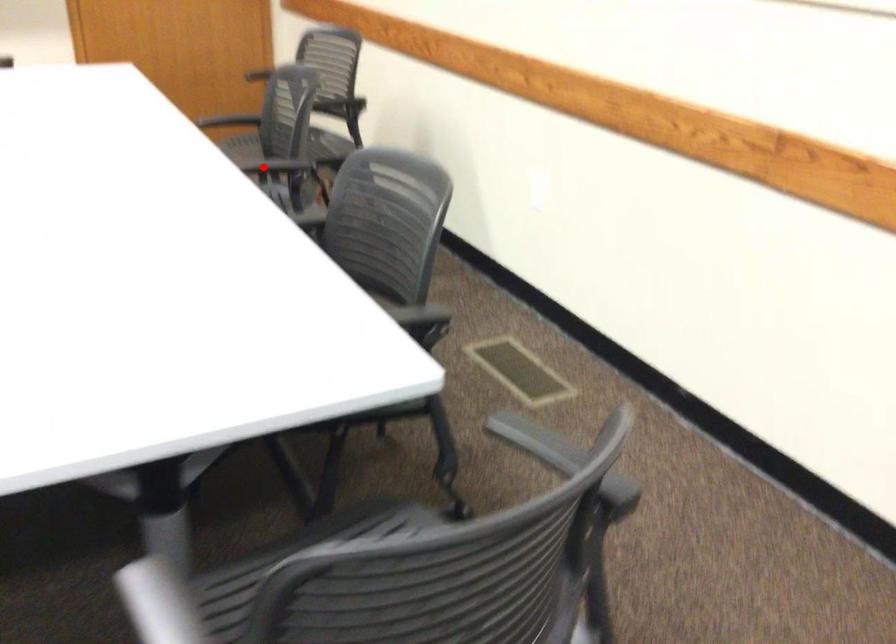
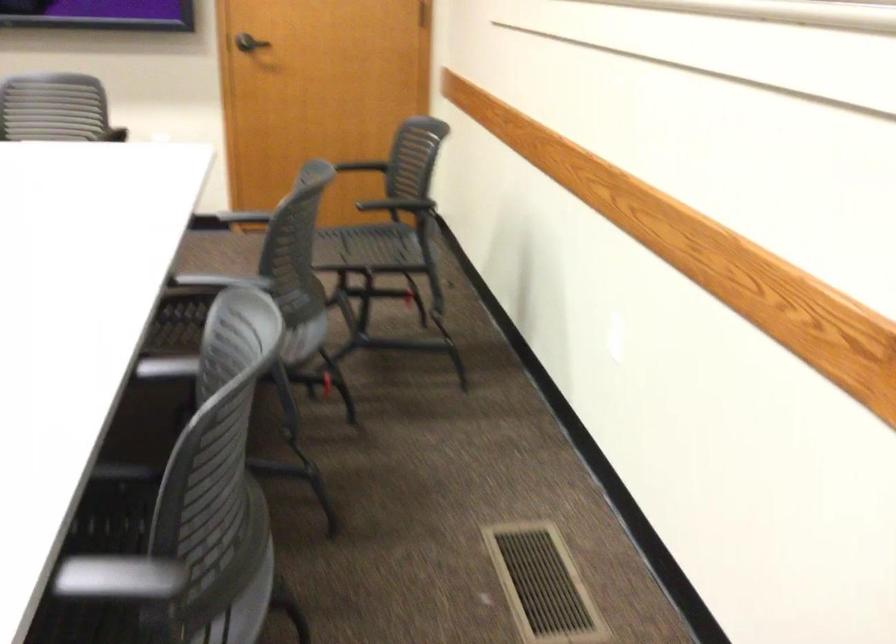
Question: I am providing you with two images of the same scene from different viewpoints. In image1, a red point is highlighted. Considering the same 3D point in image2, which of the following is correct?

Choices:
 (A) It is closer
 (B) It is farther

Answer: (A)